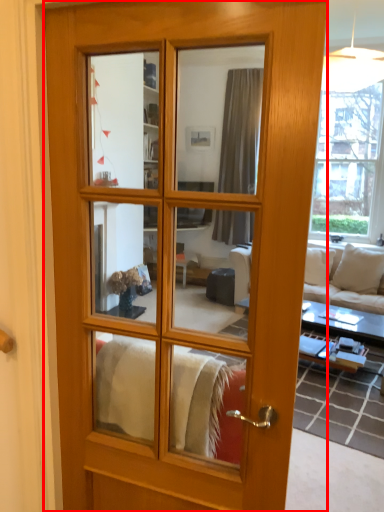
Question: Observing the image, what is the correct spatial positioning of door (annotated by the red box) in reference to studio couch?

Choices:
 (A) left
 (B) right

Answer: (A)